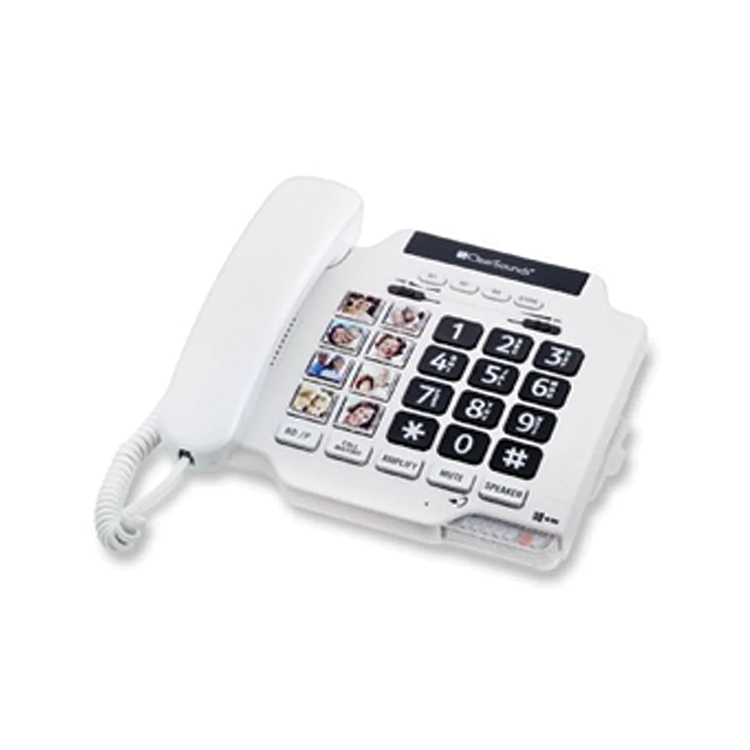
Image resolution: width=750 pixels, height=750 pixels. In order to click on cord in this screenshot , I will do `click(111, 520)`.